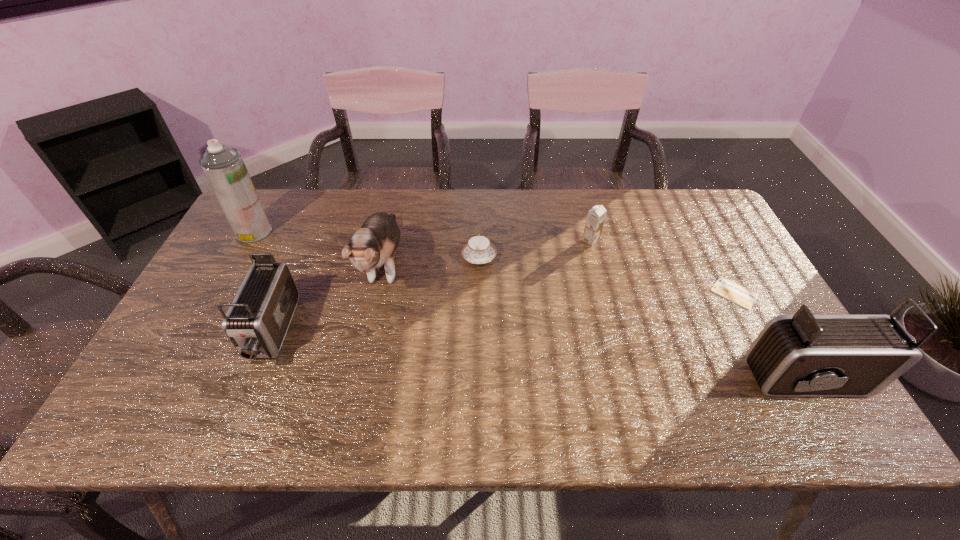
This screenshot has width=960, height=540. In the image, there is a desktop. In order to click on vacant space at the near left corner in this screenshot , I will do `click(213, 361)`.

In the image, there is a desktop. Identify the location of free space at the far right corner. (696, 209).

Locate an element on the screen. vacant space at the near right corner of the desktop is located at coordinates (747, 378).

Identify the location of vacant point located between the identity card and the shorter camcorder. (503, 313).

Find the location of `vacant area that lies between the second object from left to right and the sixth tallest object`. vacant area that lies between the second object from left to right and the sixth tallest object is located at coordinates (375, 294).

Where is `vacant space that is in between the shortest object and the second shortest object`? vacant space that is in between the shortest object and the second shortest object is located at coordinates (607, 275).

Identify the location of vacant space in between the second shortest object and the third object from left to right. This screenshot has width=960, height=540. (432, 261).

Image resolution: width=960 pixels, height=540 pixels. What are the coordinates of `free space between the chocolate milk and the leftmost object` in the screenshot? It's located at (422, 236).

Identify the location of free space between the identity card and the cat. Image resolution: width=960 pixels, height=540 pixels. (560, 279).

Find the location of a particular element. Image resolution: width=960 pixels, height=540 pixels. free space between the fourth object from left to right and the right camcorder is located at coordinates (648, 318).